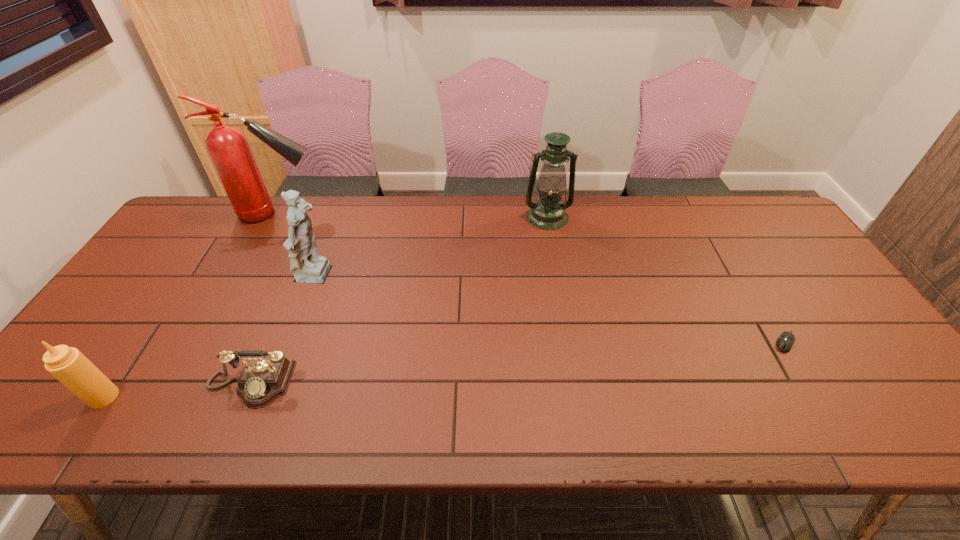
Image resolution: width=960 pixels, height=540 pixels. Identify the location of vacant space situated 0.250m on the back of the condiment. (167, 303).

Where is `free point located 0.110m on the front of the computer mouse`? This screenshot has height=540, width=960. free point located 0.110m on the front of the computer mouse is located at coordinates (816, 394).

You are a GUI agent. You are given a task and a screenshot of the screen. Output one action in this format:
    pyautogui.click(x=<x>, y=<y>)
    Task: Click on the fire extinguisher situated at the far edge
    The image size is (960, 540).
    Given the screenshot: What is the action you would take?
    pyautogui.click(x=228, y=148)

This screenshot has height=540, width=960. Identify the location of oil lamp positioned at the far edge. (548, 213).

Find the location of a particular element. The width and height of the screenshot is (960, 540). condiment at the near edge is located at coordinates (67, 364).

At what (x,y) coordinates should I click in order to perform the action: click on telephone that is at the near edge. Please return your answer as a coordinate pair (x, y). Looking at the image, I should click on (263, 379).

Where is `fire extinguisher that is at the left edge`? fire extinguisher that is at the left edge is located at coordinates 228,148.

Image resolution: width=960 pixels, height=540 pixels. I want to click on condiment positioned at the left edge, so click(x=67, y=364).

Identify the location of object at the far left corner. The image size is (960, 540). (228, 148).

Identify the location of object that is at the near left corner. The image size is (960, 540). (67, 364).